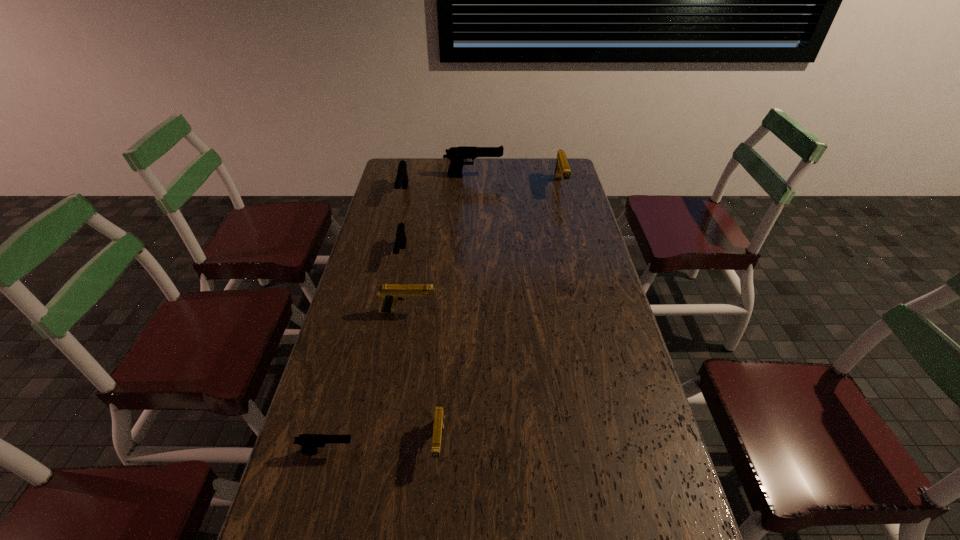
Where is `the nearest tan pistol`? The height and width of the screenshot is (540, 960). the nearest tan pistol is located at coordinates (439, 416).

The width and height of the screenshot is (960, 540). I want to click on the nearest black pistol, so click(309, 442).

Locate an element on the screen. free space located on the front-facing side of the rightmost black pistol is located at coordinates (567, 177).

The width and height of the screenshot is (960, 540). In order to click on free region located at the barrel of the rightmost pistol in this screenshot , I will do `click(565, 209)`.

Locate an element on the screen. Image resolution: width=960 pixels, height=540 pixels. free space located on the front-facing side of the second biggest black pistol is located at coordinates (387, 260).

The image size is (960, 540). What are the coordinates of `vacant area located 0.390m at the barrel of the leftmost tan pistol` in the screenshot? It's located at (559, 312).

I want to click on vacant space located 0.370m on the front-facing side of the third farthest black pistol, so click(381, 354).

Where is `vacant space located at the barrel of the nearest tan pistol`? vacant space located at the barrel of the nearest tan pistol is located at coordinates tap(434, 517).

The image size is (960, 540). Find the location of `free space located 0.400m on the front-facing side of the smallest black pistol`. free space located 0.400m on the front-facing side of the smallest black pistol is located at coordinates click(x=522, y=451).

This screenshot has width=960, height=540. I want to click on object situated at the right edge, so click(562, 169).